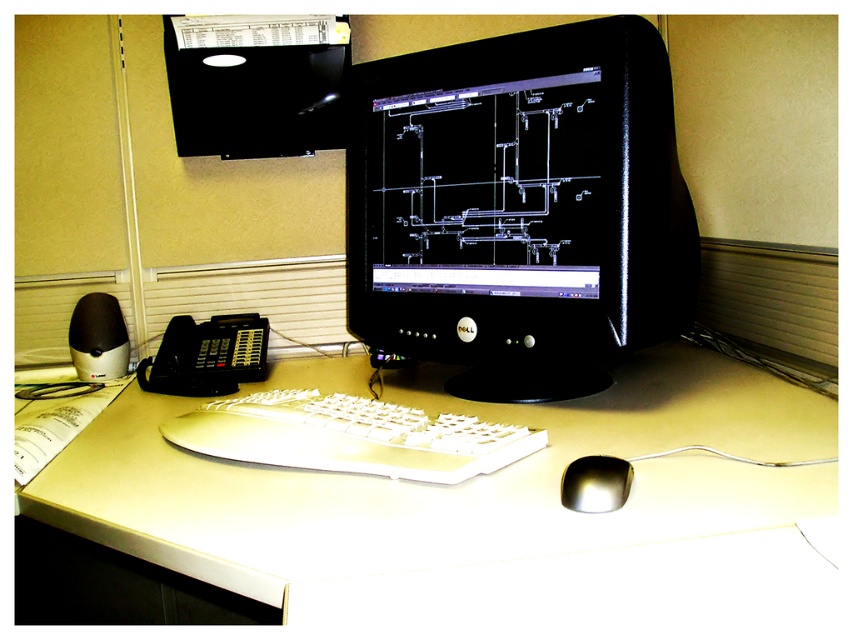
Is white plastic keyboard at center smaller than black plastic phone at lower left?

Yes, white plastic keyboard at center is smaller than black plastic phone at lower left.

Between white plastic keyboard at center and black plastic phone at lower left, which one has more height?

black plastic phone at lower left is taller.

Is point (244, 452) closer to viewer compared to point (204, 392)?

Yes.

This screenshot has width=853, height=640. Identify the location of white plastic keyboard at center. (350, 436).

Is white plastic computer desk at center bigger than black plastic phone at lower left?

Indeed, white plastic computer desk at center has a larger size compared to black plastic phone at lower left.

Is the position of white plastic computer desk at center less distant than that of black plastic phone at lower left?

Yes.

Where is `white plastic computer desk at center`? The height and width of the screenshot is (640, 853). white plastic computer desk at center is located at coordinates (489, 513).

Between white plastic computer desk at center and black glossy monitor at center, which one is positioned lower?

white plastic computer desk at center is lower down.

Which is more to the left, white plastic computer desk at center or black glossy monitor at center?

white plastic computer desk at center

Is point (495, 538) less distant than point (467, 340)?

That is True.

This screenshot has width=853, height=640. I want to click on white plastic computer desk at center, so click(489, 513).